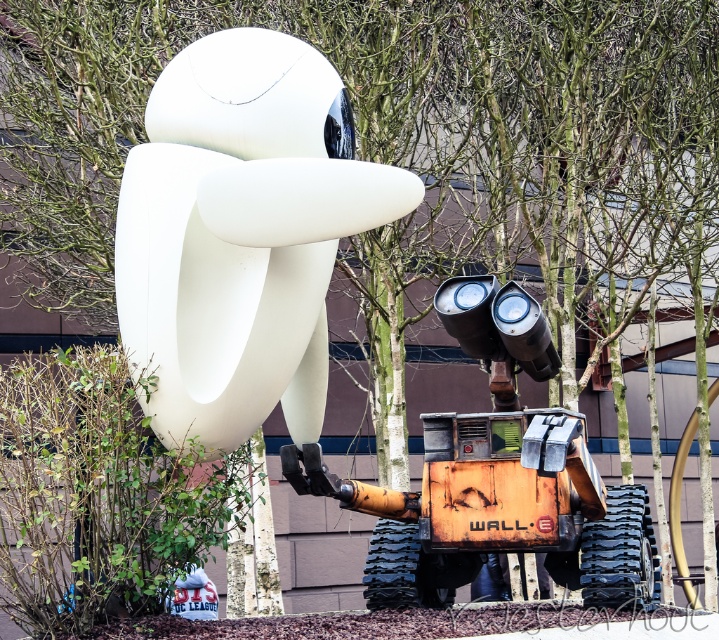
You are a city planner assessing a public square. The square has limited space, and you need to place both the white matte sculpture at center and the orange metallic excavator at center. Given their sizes, which object should be placed first to ensure both fit properly?

The white matte sculpture at center occupies less space than the orange metallic excavator at center, so place the orange metallic excavator at center first to ensure both fit properly.

In the scene shown: You are a construction worker who needs to move the orange metallic excavator at center to another location. However, you must ensure that the white matte sculpture at center remains visible to the public. Can you move the excavator without blocking the sculpture?

The white matte sculpture at center is currently in front of the orange metallic excavator at center. Since the sculpture is already in front, moving the excavator away would keep the sculpture visible. Therefore, yes, you can move the excavator without blocking the sculpture as long as it is relocated away from its current position behind the sculpture.